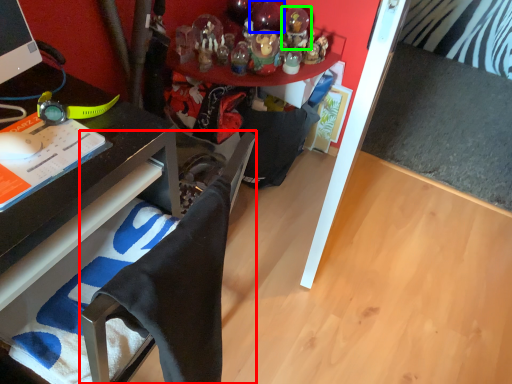
Question: Which object is positioned closest to computer chair (highlighted by a red box)? Select from toy (highlighted by a blue box) and toy (highlighted by a green box).

Choices:
 (A) toy
 (B) toy

Answer: (B)